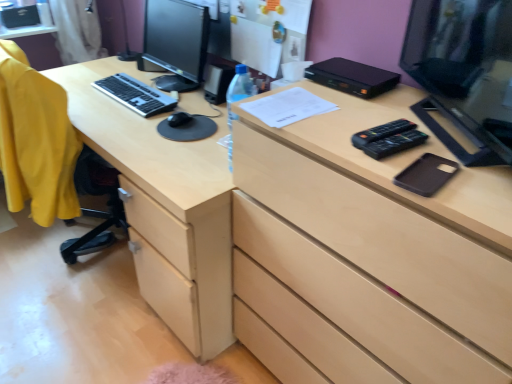
The width and height of the screenshot is (512, 384). Identify the location of vacant space in front of silver metallic keyboard at center-left. (115, 103).